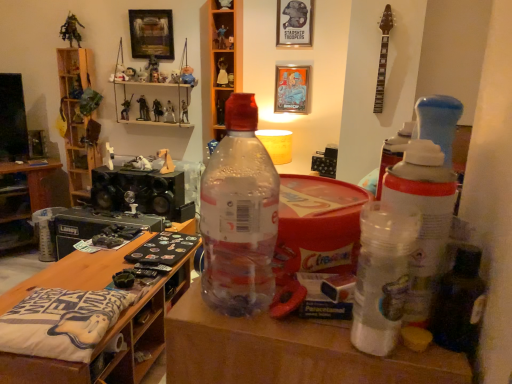
The image size is (512, 384). What do you see at coordinates (222, 73) in the screenshot?
I see `white plastic figurine at upper center, positioned as the 14th toy in left-to-right order` at bounding box center [222, 73].

This screenshot has height=384, width=512. Describe the element at coordinates (130, 74) in the screenshot. I see `plush toy at upper center, arranged as the 16th toy when viewed from the right` at that location.

Image resolution: width=512 pixels, height=384 pixels. Identify the location of plush toy at upper center, the fourteenth toy viewed from the right. (142, 75).

Where is `white fabric dog at center, the thirteenth toy viewed from the right`? Image resolution: width=512 pixels, height=384 pixels. white fabric dog at center, the thirteenth toy viewed from the right is located at coordinates (140, 163).

Between wooden shelf at left, the 1th shelf viewed from the left, and plastic toy soldier at upper center, which is the 9th toy from left to right, which one has larger width?

wooden shelf at left, the 1th shelf viewed from the left.

Is plastic toy soldier at upper center, which is the 9th toy from left to right, a part of wooden shelf at left, the 1th shelf viewed from the left?

No, plastic toy soldier at upper center, which is the 9th toy from left to right, is not inside wooden shelf at left, the 1th shelf viewed from the left.

Which of these two, wooden shelf at left, the 1th shelf viewed from the left, or plastic toy soldier at upper center, placed as the 10th toy when sorted from right to left, is smaller?

plastic toy soldier at upper center, placed as the 10th toy when sorted from right to left.

Which object is closer to the camera, metallic silver action figure at center, the tenth toy from the left, or plastic toy soldier at upper center, which is the 9th toy from left to right?

plastic toy soldier at upper center, which is the 9th toy from left to right, is more forward.

Considering the sizes of metallic silver action figure at center, positioned as the 9th toy in right-to-left order, and plastic toy soldier at upper center, placed as the 10th toy when sorted from right to left, in the image, is metallic silver action figure at center, positioned as the 9th toy in right-to-left order, wider or thinner than plastic toy soldier at upper center, placed as the 10th toy when sorted from right to left,?

In the image, metallic silver action figure at center, positioned as the 9th toy in right-to-left order, appears to be wider than plastic toy soldier at upper center, placed as the 10th toy when sorted from right to left.

Between metallic silver action figure at center, positioned as the 9th toy in right-to-left order, and plastic toy soldier at upper center, placed as the 10th toy when sorted from right to left, which one appears on the left side from the viewer's perspective?

plastic toy soldier at upper center, placed as the 10th toy when sorted from right to left.

From the image's perspective, is metallic silver action figure at center, positioned as the 9th toy in right-to-left order, above plastic toy soldier at upper center, which is the 9th toy from left to right?

Incorrect, from the image's perspective, metallic silver action figure at center, positioned as the 9th toy in right-to-left order, is lower than plastic toy soldier at upper center, which is the 9th toy from left to right.

Is matte black speaker at center, arranged as the fourth toy when viewed from the right, at the left side of plush toy at upper center, arranged as the 16th toy when viewed from the right?

Incorrect, matte black speaker at center, arranged as the fourth toy when viewed from the right, is not on the left side of plush toy at upper center, arranged as the 16th toy when viewed from the right.

Does point (216, 102) appear closer or farther from the camera than point (130, 79)?

Point (216, 102).

In terms of width, does matte black speaker at center, arranged as the fourth toy when viewed from the right, look wider or thinner when compared to plush toy at upper center, arranged as the 16th toy when viewed from the right?

Considering their sizes, matte black speaker at center, arranged as the fourth toy when viewed from the right, looks broader than plush toy at upper center, arranged as the 16th toy when viewed from the right.

Considering the positions of objects metallic silver picture frame at upper center and white fabric dog at center, which is the sixth toy from left to right, in the image provided, who is more to the left, metallic silver picture frame at upper center or white fabric dog at center, which is the sixth toy from left to right,?

white fabric dog at center, which is the sixth toy from left to right.

In terms of height, does metallic silver picture frame at upper center look taller or shorter compared to white fabric dog at center, which is the sixth toy from left to right?

Considering their sizes, metallic silver picture frame at upper center has more height than white fabric dog at center, which is the sixth toy from left to right.

Is metallic silver picture frame at upper center wider or thinner than white fabric dog at center, which is the sixth toy from left to right?

Clearly, metallic silver picture frame at upper center has less width compared to white fabric dog at center, which is the sixth toy from left to right.

Is plastic toy soldier at upper center, the 16th toy from the left, surrounded by metallic figure at shelf center, the eleventh toy positioned from the right?

No, plastic toy soldier at upper center, the 16th toy from the left, is not a part of metallic figure at shelf center, the eleventh toy positioned from the right.

Is point (159, 103) in front of point (218, 41)?

No, it is behind (218, 41).

Can you tell me how much metallic figure at shelf center, marked as the 8th toy in a left-to-right arrangement, and plastic toy soldier at upper center, the 3th toy from the right, differ in facing direction?

The angle between the facing direction of metallic figure at shelf center, marked as the 8th toy in a left-to-right arrangement, and the facing direction of plastic toy soldier at upper center, the 3th toy from the right, is 23 degrees.

Is metallic figure at shelf center, the eleventh toy positioned from the right, thinner than plastic toy soldier at upper center, the 3th toy from the right?

Yes.

Is metallic silver toy at upper center, which is the 2th toy in left-to-right order, positioned beyond the bounds of white plastic figurine at upper center, arranged as the 5th toy when viewed from the right?

That's correct, metallic silver toy at upper center, which is the 2th toy in left-to-right order, is outside of white plastic figurine at upper center, arranged as the 5th toy when viewed from the right.

Is point (121, 118) closer or farther from the camera than point (219, 82)?

Point (121, 118) appears to be farther away from the viewer than point (219, 82).

Is metallic silver toy at upper center, which is the 2th toy in left-to-right order, facing away from white plastic figurine at upper center, positioned as the 14th toy in left-to-right order?

No, metallic silver toy at upper center, which is the 2th toy in left-to-right order, is not facing the opposite direction of white plastic figurine at upper center, positioned as the 14th toy in left-to-right order.

Image resolution: width=512 pixels, height=384 pixels. In order to click on the 12th toy to the left when counting from the white plastic figurine at upper center, arranged as the 5th toy when viewed from the right in this screenshot , I will do `click(126, 108)`.

Can you tell me how much white plastic figurine at upper center, arranged as the 5th toy when viewed from the right, and wooden shelf at left, the 1th shelf viewed from the left, differ in facing direction?

0.00292 degrees separate the facing orientations of white plastic figurine at upper center, arranged as the 5th toy when viewed from the right, and wooden shelf at left, the 1th shelf viewed from the left.

Is white plastic figurine at upper center, arranged as the 5th toy when viewed from the right, at the right side of wooden shelf at left, the 1th shelf viewed from the left?

Yes, white plastic figurine at upper center, arranged as the 5th toy when viewed from the right, is to the right of wooden shelf at left, the 1th shelf viewed from the left.

Starting from the wooden shelf at left, the 1th shelf viewed from the left, which toy is the 13th one to the right? Please provide its 2D coordinates.

[(222, 73)]

Based on their sizes in the image, would you say white plastic figurine at upper center, arranged as the 5th toy when viewed from the right, is bigger or smaller than wooden shelf at left, acting as the second shelf starting from the right?

white plastic figurine at upper center, arranged as the 5th toy when viewed from the right, is smaller than wooden shelf at left, acting as the second shelf starting from the right.

Locate an element on the screen. shelf behind the plastic toy soldier at upper center, which is the 9th toy from left to right is located at coordinates (77, 119).

Identify the location of the 1st toy to the right of the plastic toy soldier at upper center, which is the 9th toy from left to right, counting from the anchor's position. (169, 113).

Based on the photo, considering their positions, is plastic toy soldier at upper center, the 1th toy positioned from the right, positioned further to plush toy at upper center, which appears as the 3th toy when viewed from the left, than metallic figure at shelf center, the eleventh toy positioned from the right?

plastic toy soldier at upper center, the 1th toy positioned from the right.

Looking at the image, which one is located closer to metallic silver picture frame at upper center, metallic green figure at upper left, which appears as the 18th toy when viewed from the right, or wooden shelf at left, acting as the second shelf starting from the right?

wooden shelf at left, acting as the second shelf starting from the right.

Looking at the image, which one is located further to plastic toy soldier at upper center, the eighteenth toy in the left-to-right sequence, white fabric dog at center, the thirteenth toy viewed from the right, or white plastic figurine at upper center, arranged as the 5th toy when viewed from the right?

white fabric dog at center, the thirteenth toy viewed from the right, lies further to plastic toy soldier at upper center, the eighteenth toy in the left-to-right sequence, than the other object.

Estimate the real-world distances between objects in this image. Which object is further from plastic figurines at upper center, arranged as the seventh toy when viewed from the left, plastic toy soldier at upper center, placed as the 10th toy when sorted from right to left, or metallic silver action figure at center, positioned as the 9th toy in right-to-left order?

Among the two, metallic silver action figure at center, positioned as the 9th toy in right-to-left order, is located further to plastic figurines at upper center, arranged as the seventh toy when viewed from the left.

When comparing their distances from plastic toy soldier at upper center, the eighteenth toy in the left-to-right sequence, does transparent plastic bottle at center or plastic figurines at upper center, arranged as the seventh toy when viewed from the left, seem further?

Based on the image, transparent plastic bottle at center appears to be further to plastic toy soldier at upper center, the eighteenth toy in the left-to-right sequence.

From the image, which object appears to be nearer to metallic silver figurine at center, which ranks as the 7th toy in right-to-left order, metallic silver action figure at center, the tenth toy from the left, or white plastic figurine at upper center, positioned as the 14th toy in left-to-right order?

Based on the image, metallic silver action figure at center, the tenth toy from the left, appears to be nearer to metallic silver figurine at center, which ranks as the 7th toy in right-to-left order.

From the image, which object appears to be nearer to white fabric dog at center, which is the sixth toy from left to right, shiny black figurine at upper center, which appears as the 15th toy when viewed from the right, or plastic toy soldier at upper center, which is the 9th toy from left to right?

Among the two, shiny black figurine at upper center, which appears as the 15th toy when viewed from the right, is located nearer to white fabric dog at center, which is the sixth toy from left to right.

Looking at the image, which one is located closer to metallic figure at shelf center, marked as the 8th toy in a left-to-right arrangement, plastic figurines at upper center, arranged as the seventh toy when viewed from the left, or transparent plastic bottle at center?

Based on the image, plastic figurines at upper center, arranged as the seventh toy when viewed from the left, appears to be nearer to metallic figure at shelf center, marked as the 8th toy in a left-to-right arrangement.

Where is `shelf between brushed metal amplifier at left and plush toy at upper center, the eighth toy in the right-to-left sequence`? The height and width of the screenshot is (384, 512). shelf between brushed metal amplifier at left and plush toy at upper center, the eighth toy in the right-to-left sequence is located at coordinates tap(77, 119).

Locate an element on the screen. Image resolution: width=512 pixels, height=384 pixels. shelf between shiny black figurine at upper center, acting as the 4th toy starting from the left, and metallic silver figurine at upper center, the 17th toy from the left is located at coordinates (219, 62).

Identify the location of shelf between metallic green figure at upper left, arranged as the first toy when viewed from the left, and transparent plastic shelf at upper center, which is counted as the 2th shelf, starting from the left. (77, 119).

Find the location of a particular element. The image size is (512, 384). shelf between plastic toy soldier at upper center, placed as the 10th toy when sorted from right to left, and metallic silver picture frame at upper center is located at coordinates (219, 62).